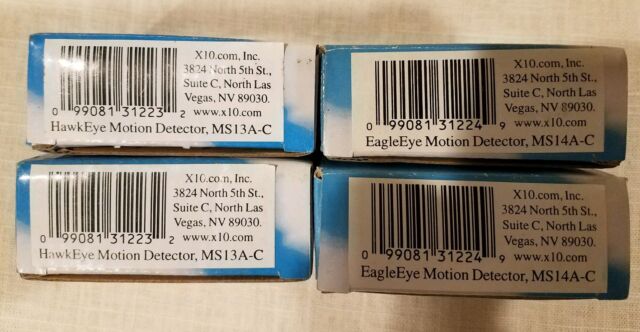
Where is `"eagleeye motion detector"`? Image resolution: width=640 pixels, height=332 pixels. "eagleeye motion detector" is located at coordinates (400, 138), (393, 278).